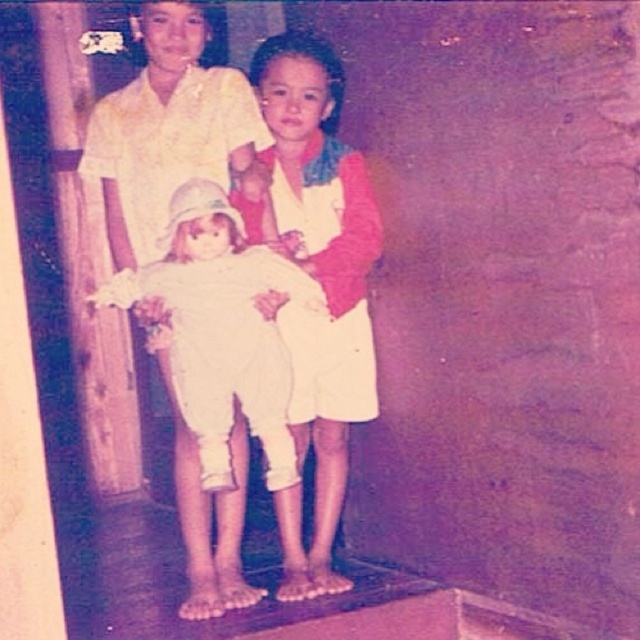
You are a tailor trying to decide which item to mend first. You see the white cotton dress at center and the white cloth doll at center. Which item requires more fabric for repairs?

The white cotton dress at center has a larger size compared to the white cloth doll at center, so it would require more fabric for repairs.

You are a photographer trying to capture the white cotton dress at center and the white cloth doll at center in the same frame. Based on their positions, which object is closer to the camera?

The white cotton dress at center is closer to the camera because the white cloth doll at center is behind it.

You are a tailor who needs to decide which item requires more fabric between the white cotton dress at center and the white cloth doll at center. Based on their sizes, which one would need more fabric?

The white cloth doll at center requires more fabric because its width is greater than the white cotton dress at center.